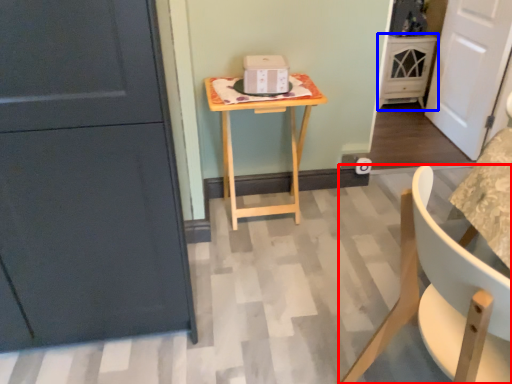
Question: Which point is further to the camera, chair (highlighted by a red box) or cabinetry (highlighted by a blue box)?

Choices:
 (A) chair
 (B) cabinetry

Answer: (B)